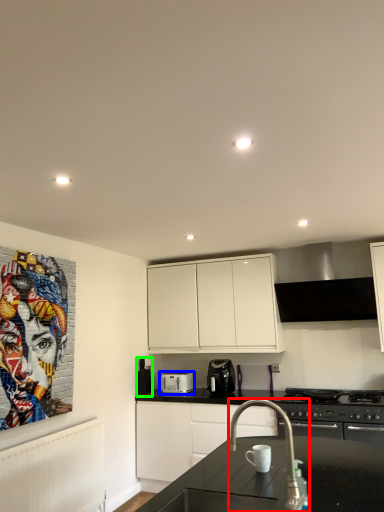
Question: Which is nearer to the tap (highlighted by a red box)? kitchen appliance (highlighted by a blue box) or appliance (highlighted by a green box).

Choices:
 (A) kitchen appliance
 (B) appliance

Answer: (A)